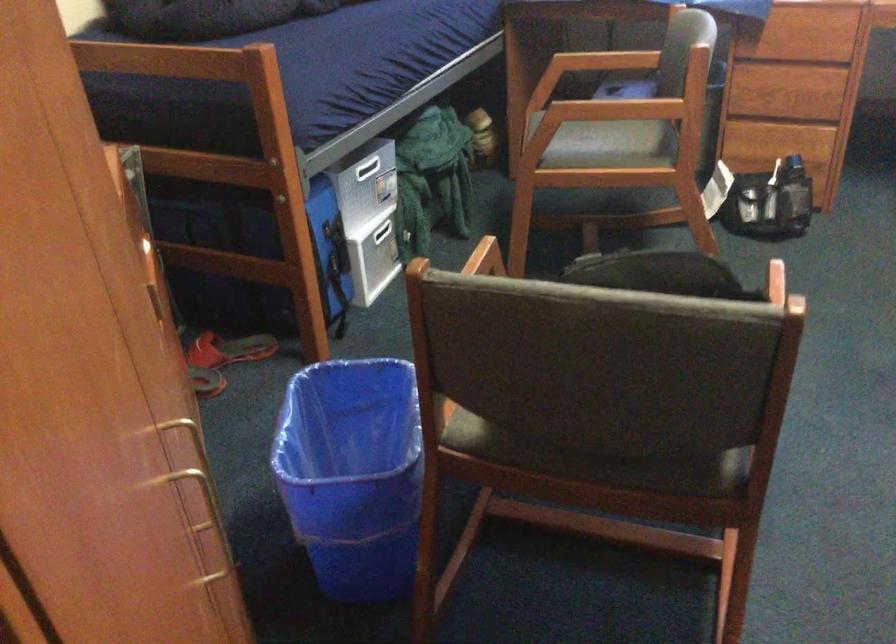
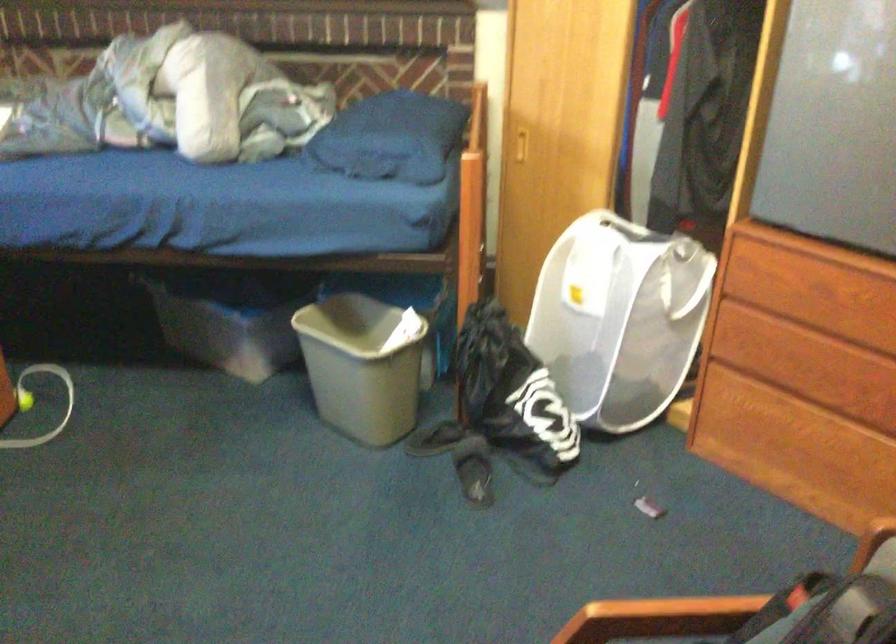
The point at (748, 344) is marked in the first image. Where is the corresponding point in the second image?

(757, 614)